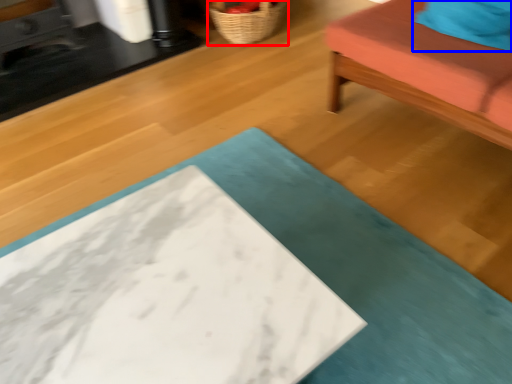
Question: Among these objects, which one is nearest to the camera, basket (highlighted by a red box) or pillow (highlighted by a blue box)?

Choices:
 (A) basket
 (B) pillow

Answer: (B)